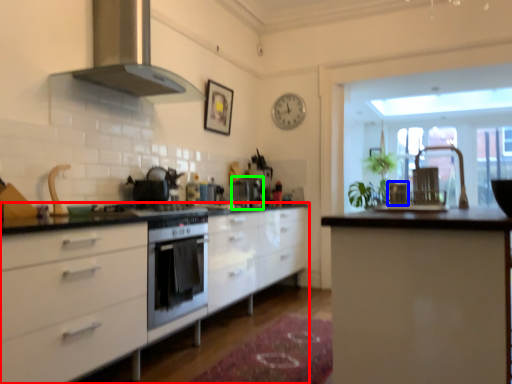
Question: Estimate the real-world distances between objects in this image. Which object is farther from cabinetry (highlighted by a red box), chair (highlighted by a blue box) or coffee machine (highlighted by a green box)?

Choices:
 (A) chair
 (B) coffee machine

Answer: (A)